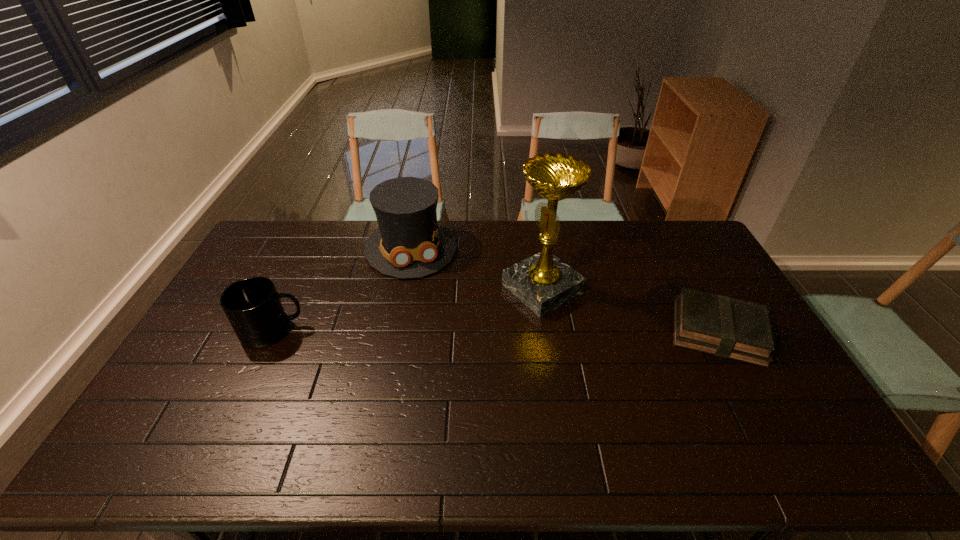
Where is `free space at the near edge`? This screenshot has height=540, width=960. free space at the near edge is located at coordinates (437, 413).

At what (x,y) coordinates should I click in order to perform the action: click on free spot at the left edge of the desktop. Please return your answer as a coordinate pair (x, y). This screenshot has height=540, width=960. Looking at the image, I should click on click(284, 264).

Image resolution: width=960 pixels, height=540 pixels. In the image, there is a desktop. In order to click on vacant space at the far left corner in this screenshot , I will do `click(295, 232)`.

Find the location of a particular element. vacant point at the far right corner is located at coordinates (677, 240).

This screenshot has width=960, height=540. I want to click on vacant area that lies between the third shortest object and the second shortest object, so click(342, 289).

Find the location of a particular element. The image size is (960, 540). blank region between the mug and the dress hat is located at coordinates (342, 289).

The width and height of the screenshot is (960, 540). I want to click on free space between the award and the mug, so point(407,310).

You are a GUI agent. You are given a task and a screenshot of the screen. Output one action in this format:
    pyautogui.click(x=<x>, y=<y>)
    Task: Click on the free space between the dress hat and the leftmost object
    The image size is (960, 540).
    Given the screenshot: What is the action you would take?
    pyautogui.click(x=342, y=289)

Find the location of a particular element. The height and width of the screenshot is (540, 960). vacant point located between the leftmost object and the rightmost object is located at coordinates (495, 332).

Locate an element on the screen. The height and width of the screenshot is (540, 960). empty space between the book and the tallest object is located at coordinates pyautogui.click(x=630, y=310).